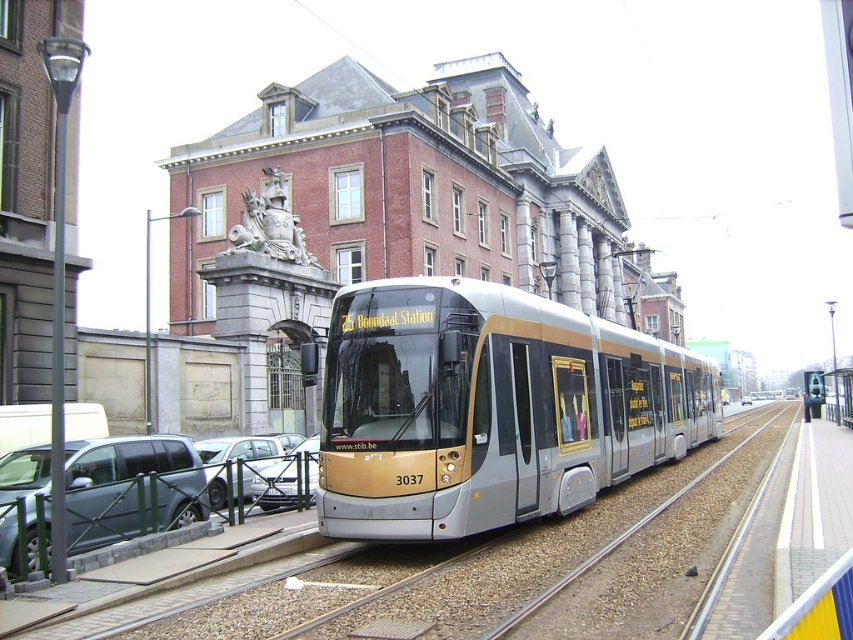
You are a delivery driver who needs to park your 2.5 meter wide truck between the gold metallic tram at center and the metallic gray suv at lower left. Is there enough space between them for your truck?

The gold metallic tram at center is 8.15 meters from the metallic gray suv at lower left. Since your truck is 2.5 meters wide, there is sufficient space between them for parking.

You are a delivery driver needing to park your vehicle, which is 2 meters wide, in a tight space between two buildings. You observe the gold metallic tram at center and the metallic gray suv at lower left in the scene. Which vehicle has a narrower width, making it easier to fit into the space?

The metallic gray suv at lower left has a narrower width than the gold metallic tram at center, so it would be easier to fit into the tight space.